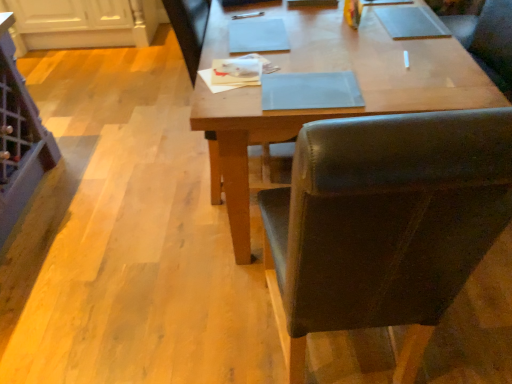
Question: Considering the positions of point (358, 134) and point (421, 107), is point (358, 134) closer or farther from the camera than point (421, 107)?

Choices:
 (A) closer
 (B) farther

Answer: (A)

Question: Looking at the image, does brown leather chair at center seem bigger or smaller compared to wooden desk at center?

Choices:
 (A) small
 (B) big

Answer: (A)

Question: Is brown leather chair at center situated inside wooden desk at center or outside?

Choices:
 (A) outside
 (B) inside

Answer: (A)

Question: Do you think wooden desk at center is within brown leather chair at center, or outside of it?

Choices:
 (A) inside
 (B) outside

Answer: (B)

Question: Does point (233, 231) appear closer or farther from the camera than point (352, 236)?

Choices:
 (A) closer
 (B) farther

Answer: (B)

Question: In terms of width, does wooden desk at center look wider or thinner when compared to brown leather chair at center?

Choices:
 (A) wide
 (B) thin

Answer: (A)

Question: Is wooden desk at center taller or shorter than brown leather chair at center?

Choices:
 (A) short
 (B) tall

Answer: (A)